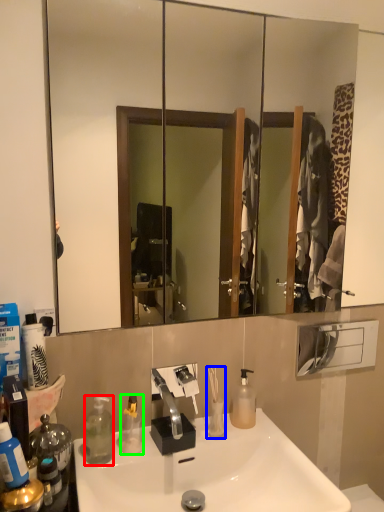
Question: Based on their relative distances, which object is nearer to bottle (highlighted by a red box)? Choose from toiletry (highlighted by a blue box) and bottle (highlighted by a green box).

Choices:
 (A) toiletry
 (B) bottle

Answer: (B)